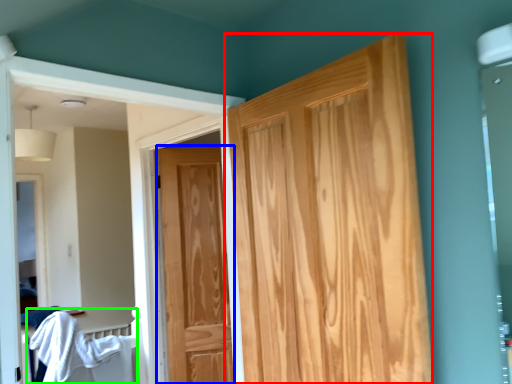
Question: Based on their relative distances, which object is nearer to door (highlighted by a red box)? Choose from door (highlighted by a blue box) and bed (highlighted by a green box).

Choices:
 (A) door
 (B) bed

Answer: (A)